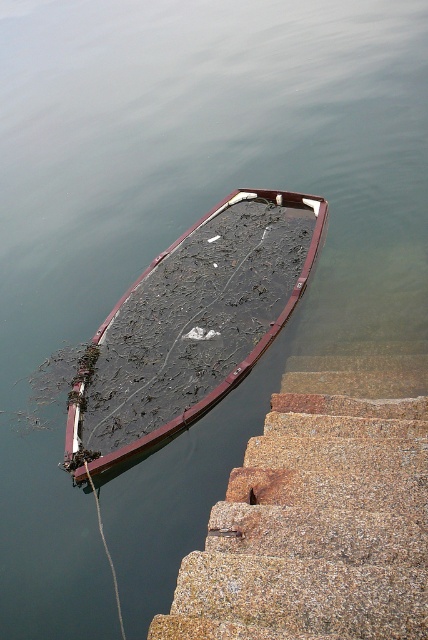
Looking at this image, who is positioned more to the left, granite steps at lower right or rusty metal boat at lower left?

From the viewer's perspective, rusty metal boat at lower left appears more on the left side.

This screenshot has height=640, width=428. Describe the element at coordinates (321, 512) in the screenshot. I see `granite steps at lower right` at that location.

Locate an element on the screen. This screenshot has height=640, width=428. granite steps at lower right is located at coordinates (321, 512).